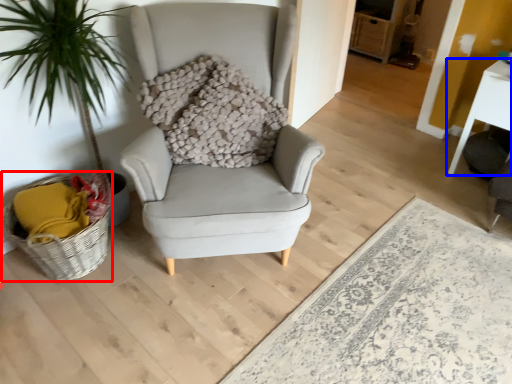
Question: Among these objects, which one is nearest to the camera, basket (highlighted by a red box) or table (highlighted by a blue box)?

Choices:
 (A) basket
 (B) table

Answer: (A)